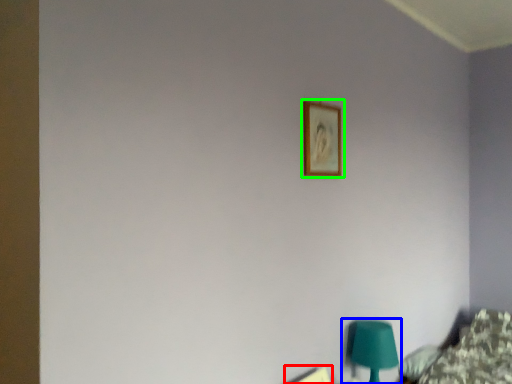
Question: Which object is positioned closest to picture frame (highlighted by a red box)? Select from table lamp (highlighted by a blue box) and picture frame (highlighted by a green box).

Choices:
 (A) table lamp
 (B) picture frame

Answer: (A)